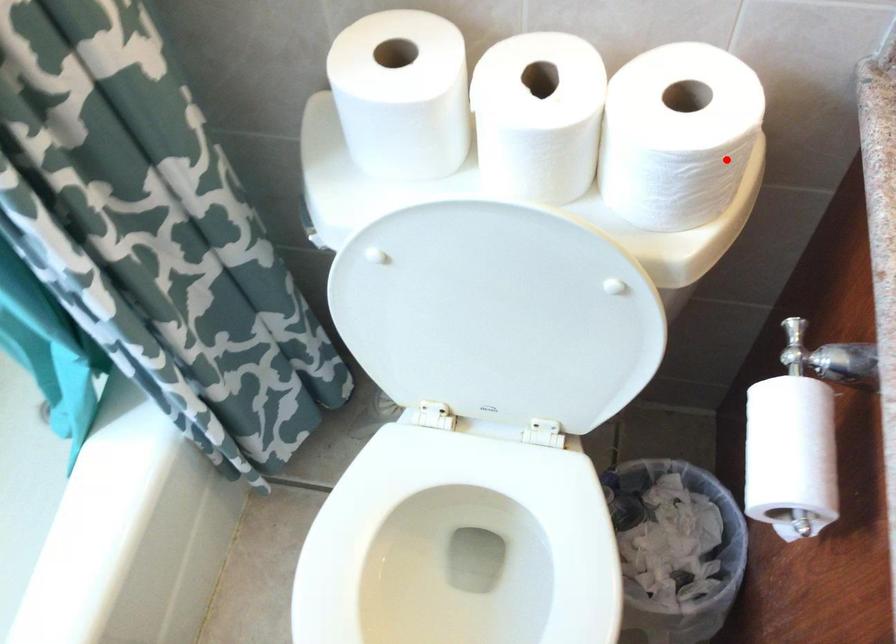
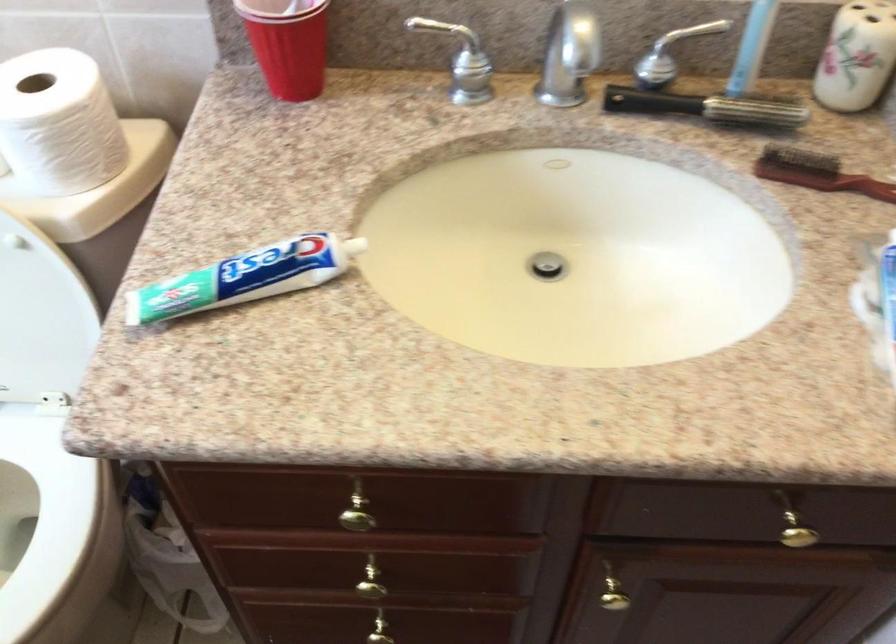
Where in the second image is the point corresponding to the highlighted location from the first image?

(58, 122)